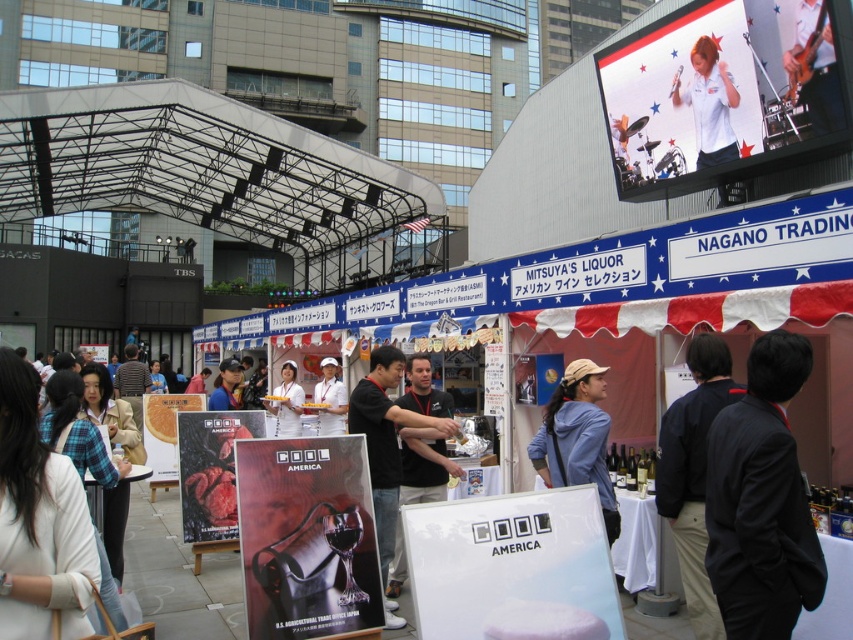
You are a photographer standing at the entrance of the trade fair. You want to take a photo that includes both the black shirt at center and the white matte cap at center. The minimum distance between the two subjects must be at least 10 meters to fit them both in the frame. Can you capture them in a single shot?

The black shirt at center is 9.77 meters away from the white matte cap at center. Since the required minimum distance is 10 meters, the photographer cannot capture both subjects in a single shot as the actual distance is less than required.

You are a photographer at the event and want to capture both the black shirt at center and the white matte cap at center in a single shot. Which object should you focus on first to ensure both are in sharp focus?

You should focus on the black shirt at center first since it is closer to the viewer than the white matte cap at center. By focusing on the closer object, the depth of field will naturally include the farther object in acceptable sharpness.